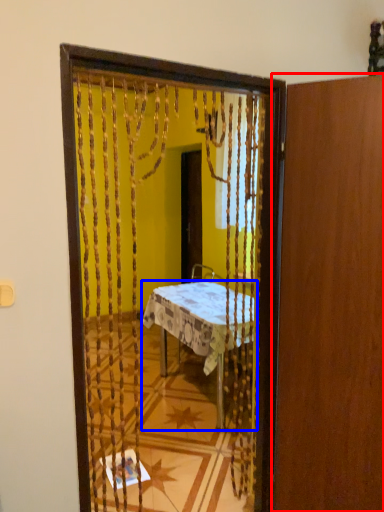
Question: Which object is closer to the camera taking this photo, door (highlighted by a red box) or desk (highlighted by a blue box)?

Choices:
 (A) door
 (B) desk

Answer: (A)